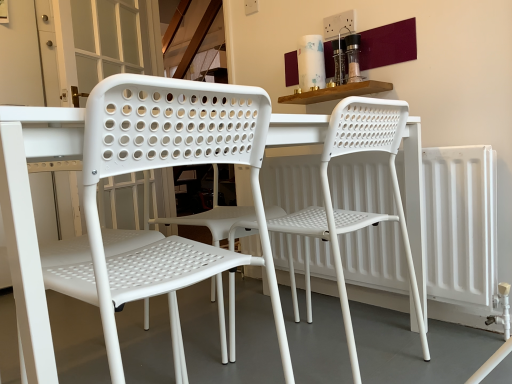
In order to click on white plastic chair at center, placed as the 2th chair when sorted from left to right in this screenshot , I will do `click(357, 211)`.

Does white matte radiator at right turn towards white plastic chair at center, the 1th chair viewed from the right?

Yes.

Are white matte radiator at right and white plastic chair at center, the 1th chair viewed from the right, located far from each other?

That's not correct — white matte radiator at right is a little close to white plastic chair at center, the 1th chair viewed from the right.

From a real-world perspective, is white matte radiator at right above or below white plastic chair at center, the 1th chair viewed from the right?

white matte radiator at right is below white plastic chair at center, the 1th chair viewed from the right.

Does white matte radiator at right have a larger size compared to white plastic chair at center, the 1th chair viewed from the right?

Actually, white matte radiator at right might be smaller than white plastic chair at center, the 1th chair viewed from the right.

Is white plastic chair at center, the 1th chair viewed from the right, beside white matte radiator at right?

No, white plastic chair at center, the 1th chair viewed from the right, is not touching white matte radiator at right.

Identify the location of the 1st chair to the left when counting from the white matte radiator at right. Image resolution: width=512 pixels, height=384 pixels. (357, 211).

Between white plastic chair at center, placed as the 2th chair when sorted from left to right, and white matte radiator at right, which one has smaller size?

Smaller between the two is white matte radiator at right.

From the image's perspective, between white plastic chair at center, the 1th chair viewed from the right, and white matte radiator at right, who is located below?

white matte radiator at right appears lower in the image.

Based on the photo, considering the sizes of white plastic chair at center, which is the 2th chair from right to left, and white matte radiator at right in the image, is white plastic chair at center, which is the 2th chair from right to left, taller or shorter than white matte radiator at right?

white plastic chair at center, which is the 2th chair from right to left, is taller than white matte radiator at right.

Are white plastic chair at center, marked as the 1th chair in a left-to-right arrangement, and white matte radiator at right far apart?

No, white plastic chair at center, marked as the 1th chair in a left-to-right arrangement, is not far from white matte radiator at right.

Is white plastic chair at center, marked as the 1th chair in a left-to-right arrangement, aimed at white matte radiator at right?

No, white plastic chair at center, marked as the 1th chair in a left-to-right arrangement, is not turned towards white matte radiator at right.

From the image's perspective, is white plastic chair at center, which is the 2th chair from right to left, over white plastic chair at center, placed as the 2th chair when sorted from left to right?

No, from the image's perspective, white plastic chair at center, which is the 2th chair from right to left, is not over white plastic chair at center, placed as the 2th chair when sorted from left to right.

Which of these two, white plastic chair at center, marked as the 1th chair in a left-to-right arrangement, or white plastic chair at center, placed as the 2th chair when sorted from left to right, stands taller?

With more height is white plastic chair at center, placed as the 2th chair when sorted from left to right.

Does white plastic chair at center, which is the 2th chair from right to left, touch white plastic chair at center, placed as the 2th chair when sorted from left to right?

No, white plastic chair at center, which is the 2th chair from right to left, is not in contact with white plastic chair at center, placed as the 2th chair when sorted from left to right.

From a real-world perspective, is white plastic chair at center, marked as the 1th chair in a left-to-right arrangement, physically located above or below white plastic chair at center, the 1th chair viewed from the right?

white plastic chair at center, marked as the 1th chair in a left-to-right arrangement, is above white plastic chair at center, the 1th chair viewed from the right.

Is white plastic chair at center, placed as the 2th chair when sorted from left to right, inside the boundaries of white plastic chair at center, marked as the 1th chair in a left-to-right arrangement, or outside?

white plastic chair at center, placed as the 2th chair when sorted from left to right, cannot be found inside white plastic chair at center, marked as the 1th chair in a left-to-right arrangement.

Which of these two, white plastic chair at center, placed as the 2th chair when sorted from left to right, or white plastic chair at center, marked as the 1th chair in a left-to-right arrangement, stands taller?

white plastic chair at center, placed as the 2th chair when sorted from left to right.

Is white plastic chair at center, placed as the 2th chair when sorted from left to right, positioned with its back to white plastic chair at center, which is the 2th chair from right to left?

No, white plastic chair at center, placed as the 2th chair when sorted from left to right, is not facing away from white plastic chair at center, which is the 2th chair from right to left.

Is point (344, 223) in front of point (124, 300)?

No.

Which object is positioned more to the right, white matte radiator at right or white plastic chair at center, marked as the 1th chair in a left-to-right arrangement?

→ Positioned to the right is white matte radiator at right.

Measure the distance from white matte radiator at right to white plastic chair at center, which is the 2th chair from right to left.

white matte radiator at right and white plastic chair at center, which is the 2th chair from right to left, are 30.02 inches apart from each other.

Would you say white matte radiator at right is inside or outside white plastic chair at center, which is the 2th chair from right to left?

white matte radiator at right cannot be found inside white plastic chair at center, which is the 2th chair from right to left.

Consider the image. How different are the orientations of white matte radiator at right and white plastic chair at center, marked as the 1th chair in a left-to-right arrangement, in degrees?

They differ by 90.5 degrees in their facing directions.

In order to click on radiator on the right of the white plastic chair at center, placed as the 2th chair when sorted from left to right in this screenshot , I will do `click(460, 224)`.

Find the location of a particular element. This screenshot has width=512, height=384. chair above the white matte radiator at right (from the image's perspective) is located at coordinates pos(357,211).

When comparing their distances from white plastic chair at center, the 1th chair viewed from the right, does white plastic chair at center, marked as the 1th chair in a left-to-right arrangement, or white matte radiator at right seem closer?

white matte radiator at right is closer to white plastic chair at center, the 1th chair viewed from the right.

Based on their spatial positions, is white plastic chair at center, the 1th chair viewed from the right, or white plastic chair at center, which is the 2th chair from right to left, further from white matte radiator at right?

The object further to white matte radiator at right is white plastic chair at center, which is the 2th chair from right to left.

From the image, which object appears to be nearer to white plastic chair at center, marked as the 1th chair in a left-to-right arrangement, white plastic chair at center, placed as the 2th chair when sorted from left to right, or white matte radiator at right?

white plastic chair at center, placed as the 2th chair when sorted from left to right, lies closer to white plastic chair at center, marked as the 1th chair in a left-to-right arrangement, than the other object.

When comparing their distances from white plastic chair at center, marked as the 1th chair in a left-to-right arrangement, does white matte radiator at right or white plastic chair at center, the 1th chair viewed from the right, seem further?

white matte radiator at right is further to white plastic chair at center, marked as the 1th chair in a left-to-right arrangement.

Based on the photo, looking at the image, which one is located further to white plastic chair at center, the 1th chair viewed from the right, white matte radiator at right or white plastic chair at center, marked as the 1th chair in a left-to-right arrangement?

white plastic chair at center, marked as the 1th chair in a left-to-right arrangement, is positioned further to the anchor white plastic chair at center, the 1th chair viewed from the right.

Based on their spatial positions, is white plastic chair at center, marked as the 1th chair in a left-to-right arrangement, or white plastic chair at center, placed as the 2th chair when sorted from left to right, further from white matte radiator at right?

white plastic chair at center, marked as the 1th chair in a left-to-right arrangement, lies further to white matte radiator at right than the other object.

The width and height of the screenshot is (512, 384). I want to click on chair between white plastic chair at center, marked as the 1th chair in a left-to-right arrangement, and white matte radiator at right, in the horizontal direction, so click(x=357, y=211).